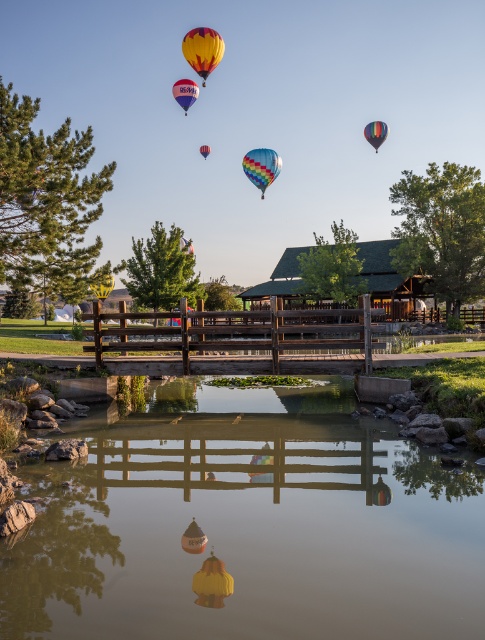
Which is more to the left, smooth reflective water at center or brown wooden bridge at center?

From the viewer's perspective, smooth reflective water at center appears more on the left side.

Is point (206, 508) closer to camera compared to point (101, 330)?

Yes, it is in front of point (101, 330).

At what (x,y) coordinates should I click in order to perform the action: click on smooth reflective water at center. Please return your answer as a coordinate pair (x, y). This screenshot has height=640, width=485. Looking at the image, I should click on (245, 525).

Who is positioned more to the left, smooth reflective water at center or yellow striped fabric hot air balloon at upper center?

yellow striped fabric hot air balloon at upper center is more to the left.

Does point (296, 438) lie behind point (100, 285)?

No, it is in front of (100, 285).

This screenshot has width=485, height=640. What are the coordinates of `smooth reflective water at center` in the screenshot? It's located at (245, 525).

Which is more to the right, brown wooden bridge at center or rainbow striped balloon at center?

Positioned to the right is rainbow striped balloon at center.

Between brown wooden bridge at center and rainbow striped balloon at center, which one has less height?

With less height is brown wooden bridge at center.

I want to click on brown wooden bridge at center, so (239, 336).